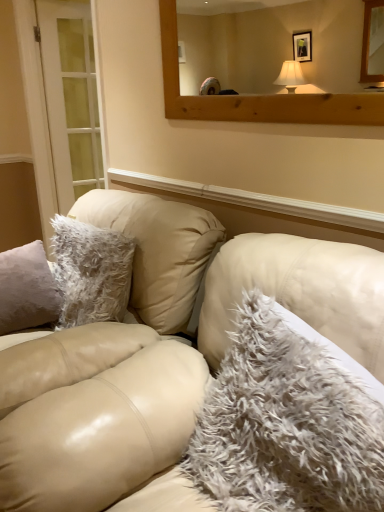
Question: Is point [334, 377] positioned closer to the camera than point [178, 252]?

Choices:
 (A) closer
 (B) farther

Answer: (A)

Question: In the image, is fuzzy white pillow at center positioned in front of or behind leather couch at center?

Choices:
 (A) behind
 (B) front

Answer: (A)

Question: Based on their relative distances, which object is nearer to the leather couch at center?

Choices:
 (A) white glass door at left
 (B) fuzzy white pillow at center
 (C) wooden mirror at upper center

Answer: (B)

Question: Which object is positioned farthest from the leather couch at center?

Choices:
 (A) wooden mirror at upper center
 (B) white glass door at left
 (C) fuzzy white pillow at center

Answer: (B)